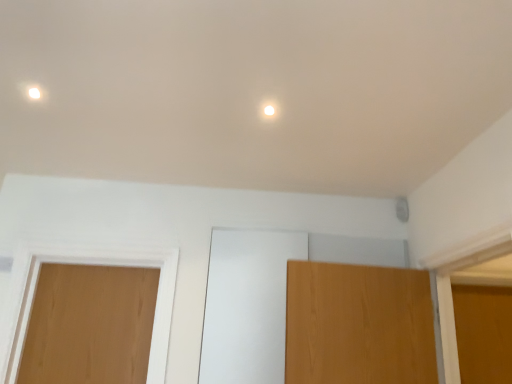
The height and width of the screenshot is (384, 512). In order to click on white glossy light fixture at upper center in this screenshot , I will do `click(269, 110)`.

What do you see at coordinates (269, 110) in the screenshot? Image resolution: width=512 pixels, height=384 pixels. I see `white glossy light fixture at upper center` at bounding box center [269, 110].

Find the location of a particular element. light brown wood door at left is located at coordinates (90, 325).

Image resolution: width=512 pixels, height=384 pixels. What do you see at coordinates (90, 325) in the screenshot?
I see `light brown wood door at left` at bounding box center [90, 325].

This screenshot has height=384, width=512. What are the coordinates of `white glossy light fixture at upper center` in the screenshot? It's located at (269, 110).

Between light brown wood door at left and white glossy light fixture at upper center, which one appears on the right side from the viewer's perspective?

white glossy light fixture at upper center is more to the right.

Does light brown wood door at left come behind white glossy light fixture at upper center?

Yes, it is.

Which is closer, (59,379) or (264,113)?

Point (59,379).

From the image's perspective, would you say light brown wood door at left is positioned over white glossy light fixture at upper center?

No, from the image's perspective, light brown wood door at left is not on top of white glossy light fixture at upper center.

From a real-world perspective, which object rests below the other?

In real-world perspective, light brown wood door at left is lower.

Looking at their sizes, would you say light brown wood door at left is wider or thinner than white glossy light fixture at upper center?

In the image, light brown wood door at left appears to be wider than white glossy light fixture at upper center.

Considering the relative sizes of light brown wood door at left and white glossy light fixture at upper center in the image provided, is light brown wood door at left shorter than white glossy light fixture at upper center?

No, light brown wood door at left is not shorter than white glossy light fixture at upper center.

Who is smaller, light brown wood door at left or white glossy light fixture at upper center?

white glossy light fixture at upper center is smaller.

Is light brown wood door at left spatially inside white glossy light fixture at upper center, or outside of it?

light brown wood door at left cannot be found inside white glossy light fixture at upper center.

Is light brown wood door at left far from white glossy light fixture at upper center?

Yes, light brown wood door at left is far from white glossy light fixture at upper center.

Is light brown wood door at left oriented away from white glossy light fixture at upper center?

No, light brown wood door at left is not facing away from white glossy light fixture at upper center.

I want to click on door to the left of white glossy light fixture at upper center, so click(x=90, y=325).

From the picture: Can you confirm if white glossy light fixture at upper center is positioned to the right of light brown wood door at left?

Indeed, white glossy light fixture at upper center is positioned on the right side of light brown wood door at left.

Is the depth of white glossy light fixture at upper center less than that of light brown wood door at left?

Yes, the depth of white glossy light fixture at upper center is less than that of light brown wood door at left.

In the scene shown: Which is closer, (273, 110) or (95, 302)?

Point (273, 110) appears to be closer to the viewer than point (95, 302).

From the image's perspective, which is below, white glossy light fixture at upper center or light brown wood door at left?

light brown wood door at left appears lower in the image.

From a real-world perspective, is white glossy light fixture at upper center located higher than light brown wood door at left?

Indeed, from a real-world perspective, white glossy light fixture at upper center stands above light brown wood door at left.

Which object is thinner, white glossy light fixture at upper center or light brown wood door at left?

white glossy light fixture at upper center is thinner.

In the scene shown: Between white glossy light fixture at upper center and light brown wood door at left, which one has less height?

Standing shorter between the two is white glossy light fixture at upper center.

Considering the sizes of objects white glossy light fixture at upper center and light brown wood door at left in the image provided, who is smaller, white glossy light fixture at upper center or light brown wood door at left?

Smaller between the two is white glossy light fixture at upper center.

Could light brown wood door at left be considered to be inside white glossy light fixture at upper center?

No, light brown wood door at left is not inside white glossy light fixture at upper center.

Is white glossy light fixture at upper center not close to light brown wood door at left?

Absolutely, white glossy light fixture at upper center is distant from light brown wood door at left.

Is white glossy light fixture at upper center oriented towards light brown wood door at left?

No, white glossy light fixture at upper center is not facing towards light brown wood door at left.

This screenshot has height=384, width=512. Identify the location of dot on the right of light brown wood door at left. click(x=269, y=110).

What are the coordinates of `dot above the light brown wood door at left (from the image's perspective)` in the screenshot? It's located at (269, 110).

You are a GUI agent. You are given a task and a screenshot of the screen. Output one action in this format:
    pyautogui.click(x=<x>, y=<y>)
    Task: Click on the dot on the right of light brown wood door at left
    The image size is (512, 384).
    Given the screenshot: What is the action you would take?
    pyautogui.click(x=269, y=110)